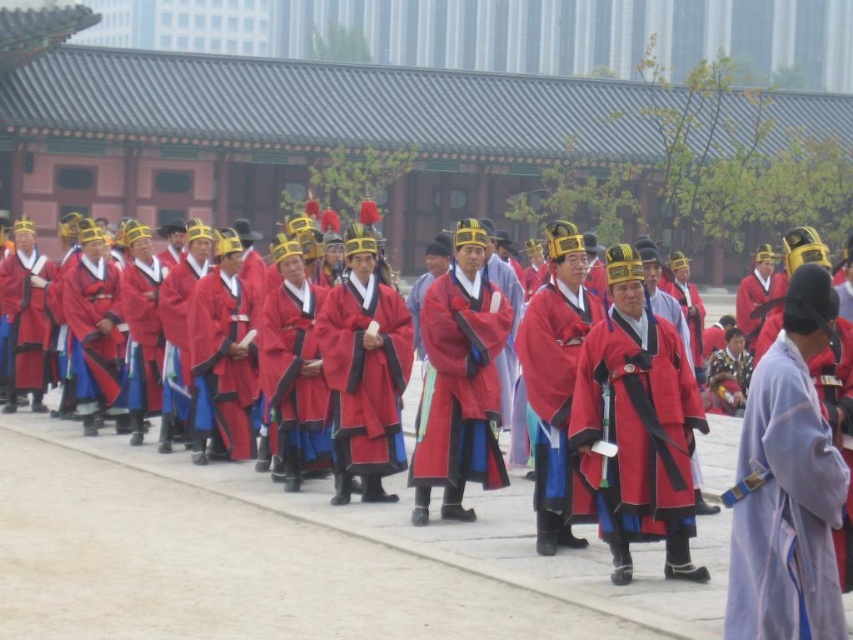
Question: Does matte red robe at center appear on the left side of light purple silk robe at right?

Choices:
 (A) no
 (B) yes

Answer: (B)

Question: Which point appears farthest from the camera in this image?

Choices:
 (A) (805, 600)
 (B) (357, 550)

Answer: (B)

Question: Does matte red robe at center have a lesser width compared to light purple silk robe at right?

Choices:
 (A) yes
 (B) no

Answer: (A)

Question: Which of the following is the closest to the observer?

Choices:
 (A) matte red robe at center
 (B) light purple silk robe at right

Answer: (B)

Question: Which point is closer to the camera taking this photo?

Choices:
 (A) (805, 417)
 (B) (207, 474)

Answer: (A)

Question: Can you confirm if matte red robe at center is positioned to the right of light purple silk robe at right?

Choices:
 (A) no
 (B) yes

Answer: (A)